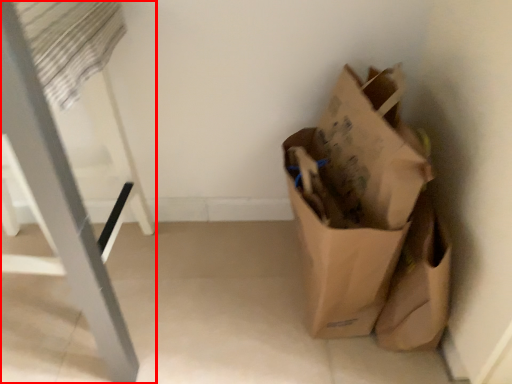
Question: Observing the image, what is the correct spatial positioning of furniture (annotated by the red box) in reference to grocery bag?

Choices:
 (A) left
 (B) right

Answer: (A)